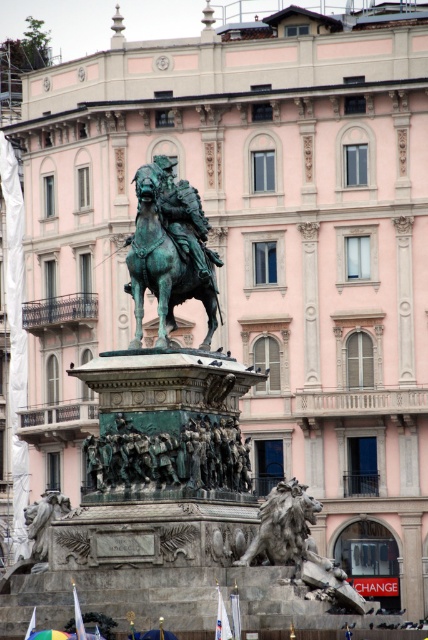
The height and width of the screenshot is (640, 428). What do you see at coordinates (285, 528) in the screenshot?
I see `gray stone lion at center` at bounding box center [285, 528].

Between point (273, 513) and point (216, 611), which one is positioned behind?

The point (273, 513) is behind.

Find the location of a particular element. The image size is (428, 640). gray stone lion at center is located at coordinates (285, 528).

The width and height of the screenshot is (428, 640). I want to click on gray stone lion at center, so click(285, 528).

Can you confirm if gray stone lion at center is smaller than white fabric flag at lower left?

No, gray stone lion at center is not smaller than white fabric flag at lower left.

Which of these two, gray stone lion at center or white fabric flag at lower left, stands shorter?

Standing shorter between the two is white fabric flag at lower left.

Is point (258, 552) more distant than point (32, 630)?

Yes, point (258, 552) is farther from viewer.

Where is `gray stone lion at center`? gray stone lion at center is located at coordinates (285, 528).

Is white fabric flag at lower center to the right of white fabric flag at lower left from the viewer's perspective?

Yes, white fabric flag at lower center is to the right of white fabric flag at lower left.

Does point (222, 618) lie behind point (27, 634)?

No, (222, 618) is closer to viewer.

Identify the location of white fabric flag at lower center. The image size is (428, 640). (222, 620).